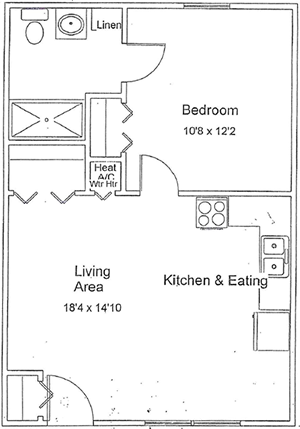
You are a GUI agent. You are given a task and a screenshot of the screen. Output one action in this format:
    pyautogui.click(x=<x>, y=<y>)
    Task: Click on the fridge
    
    Given the screenshot: What is the action you would take?
    pyautogui.click(x=269, y=327)